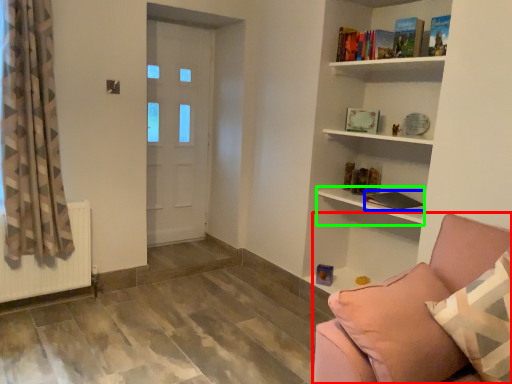
Question: Considering the real-world distances, which object is farthest from studio couch (highlighted by a red box)? book (highlighted by a blue box) or shelf (highlighted by a green box)?

Choices:
 (A) book
 (B) shelf

Answer: (A)